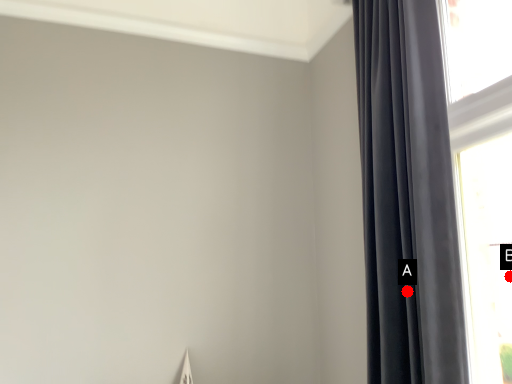
Question: Two points are circled on the image, labeled by A and B beside each circle. Which of the following is the closest to the observer?

Choices:
 (A) A is closer
 (B) B is closer

Answer: (A)